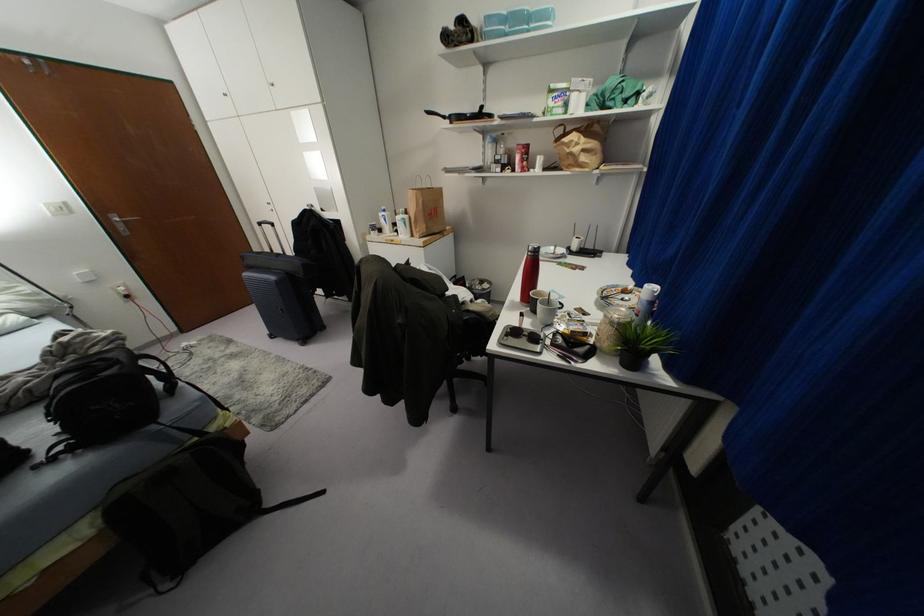
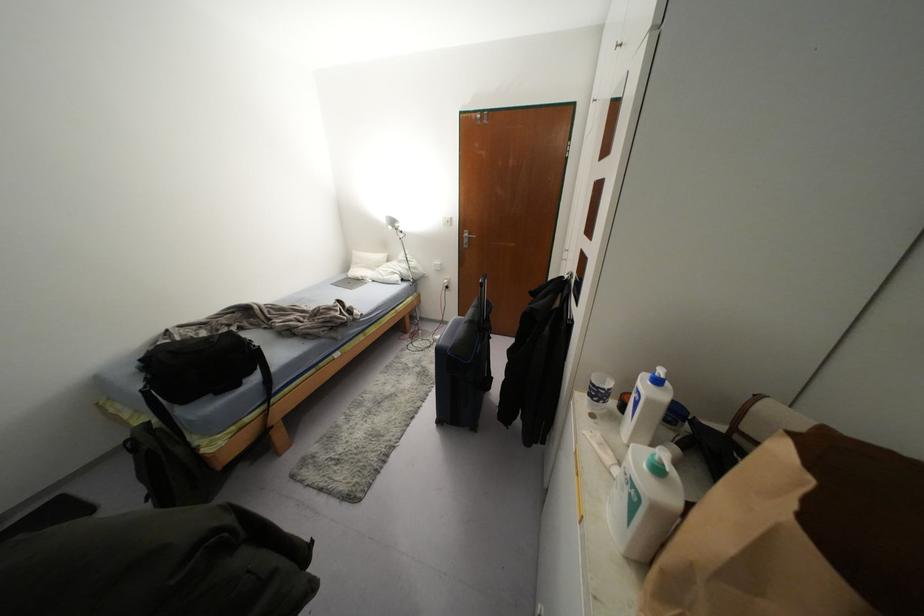
Find the pixel in the second image that matches the point at 383,209 in the first image.

(658, 381)